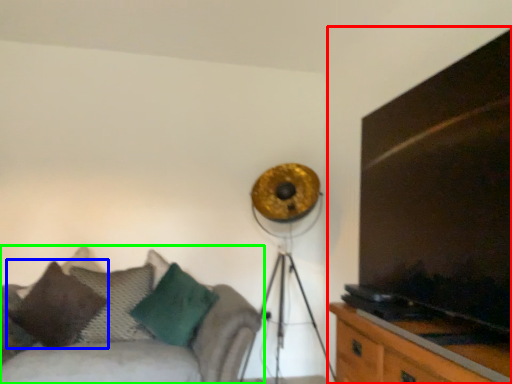
Question: Which object is the farthest from entertainment center (highlighted by a red box)? Choose among these: pillow (highlighted by a blue box) or studio couch (highlighted by a green box).

Choices:
 (A) pillow
 (B) studio couch

Answer: (A)